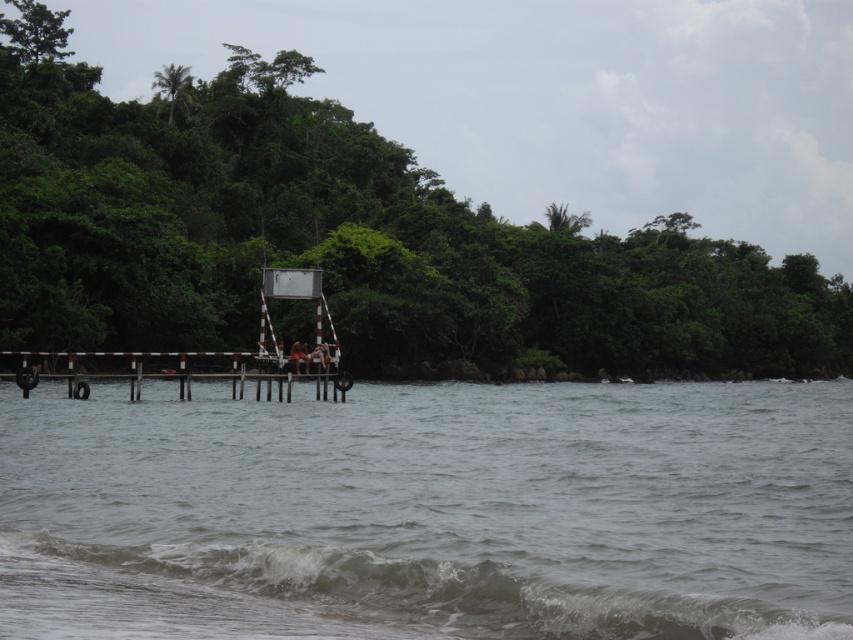
Question: Which point is closer to the camera?

Choices:
 (A) (129, 369)
 (B) (288, 356)
 (C) (311, 353)
 (D) (88, 403)

Answer: (B)

Question: Can you confirm if gray water at lower left is positioned below brown wooden dock at center?

Choices:
 (A) yes
 (B) no

Answer: (A)

Question: Based on their relative distances, which object is farther from the gray frothy wave at lower center?

Choices:
 (A) smooth skin person at center
 (B) brown wooden dock at center
 (C) blonde hair person at center
 (D) gray water at lower left

Answer: (B)

Question: Which object appears farthest from the camera in this image?

Choices:
 (A) blonde hair person at center
 (B) gray frothy wave at lower center

Answer: (A)

Question: Does gray water at lower left have a lesser width compared to brown wooden dock at center?

Choices:
 (A) yes
 (B) no

Answer: (B)

Question: Can you confirm if gray frothy wave at lower center is smaller than brown wooden dock at center?

Choices:
 (A) yes
 (B) no

Answer: (A)